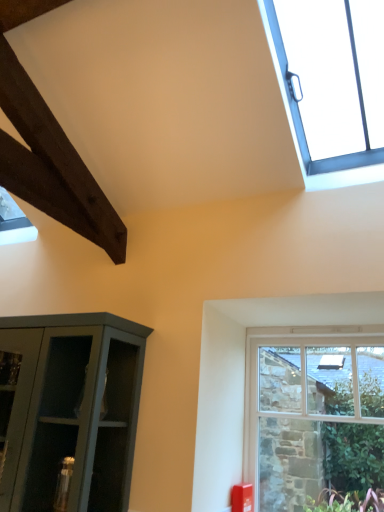
Image resolution: width=384 pixels, height=512 pixels. What do you see at coordinates (332, 78) in the screenshot?
I see `clear glass window at upper right, which is the second window from bottom to top` at bounding box center [332, 78].

The width and height of the screenshot is (384, 512). In order to click on clear glass window at upper right, marked as the 1th window in a top-to-bottom arrangement in this screenshot , I will do `click(332, 78)`.

Identify the location of clear glass window at lower right, the second window from the top. Image resolution: width=384 pixels, height=512 pixels. (244, 375).

What do you see at coordinates (244, 375) in the screenshot? Image resolution: width=384 pixels, height=512 pixels. I see `clear glass window at lower right, the second window from the top` at bounding box center [244, 375].

Locate an element on the screen. This screenshot has width=384, height=512. clear glass window at upper right, marked as the 1th window in a top-to-bottom arrangement is located at coordinates (332, 78).

Can you confirm if clear glass window at lower right, placed as the first window when sorted from bottom to top, is positioned to the left of clear glass window at upper right, marked as the 1th window in a top-to-bottom arrangement?

No, clear glass window at lower right, placed as the first window when sorted from bottom to top, is not to the left of clear glass window at upper right, marked as the 1th window in a top-to-bottom arrangement.

Considering the positions of objects clear glass window at lower right, placed as the first window when sorted from bottom to top, and clear glass window at upper right, which is the second window from bottom to top, in the image provided, who is behind, clear glass window at lower right, placed as the first window when sorted from bottom to top, or clear glass window at upper right, which is the second window from bottom to top,?

clear glass window at lower right, placed as the first window when sorted from bottom to top, is behind.

Considering the positions of point (226, 336) and point (350, 12), is point (226, 336) closer or farther from the camera than point (350, 12)?

Point (226, 336) is closer to the camera than point (350, 12).

From the image's perspective, is clear glass window at lower right, the second window from the top, beneath clear glass window at upper right, marked as the 1th window in a top-to-bottom arrangement?

Yes, from the image's perspective, clear glass window at lower right, the second window from the top, is beneath clear glass window at upper right, marked as the 1th window in a top-to-bottom arrangement.

From a real-world perspective, which object stands above the other?

From a 3D spatial view, clear glass window at upper right, marked as the 1th window in a top-to-bottom arrangement, is above.

Which of these two, clear glass window at lower right, the second window from the top, or clear glass window at upper right, marked as the 1th window in a top-to-bottom arrangement, is thinner?

clear glass window at lower right, the second window from the top.

Considering the relative sizes of clear glass window at lower right, the second window from the top, and clear glass window at upper right, which is the second window from bottom to top, in the image provided, is clear glass window at lower right, the second window from the top, taller than clear glass window at upper right, which is the second window from bottom to top,?

Indeed, clear glass window at lower right, the second window from the top, has a greater height compared to clear glass window at upper right, which is the second window from bottom to top.

Looking at this image, who is smaller, clear glass window at lower right, placed as the first window when sorted from bottom to top, or clear glass window at upper right, marked as the 1th window in a top-to-bottom arrangement?

clear glass window at lower right, placed as the first window when sorted from bottom to top.

Is clear glass window at upper right, which is the second window from bottom to top, surrounded by clear glass window at lower right, placed as the first window when sorted from bottom to top?

Actually, clear glass window at upper right, which is the second window from bottom to top, is outside clear glass window at lower right, placed as the first window when sorted from bottom to top.

Is clear glass window at lower right, placed as the first window when sorted from bottom to top, far away from clear glass window at upper right, which is the second window from bottom to top?

Yes, clear glass window at lower right, placed as the first window when sorted from bottom to top, and clear glass window at upper right, which is the second window from bottom to top, are located far from each other.

Is clear glass window at lower right, placed as the first window when sorted from bottom to top, aimed at clear glass window at upper right, which is the second window from bottom to top?

No, clear glass window at lower right, placed as the first window when sorted from bottom to top, is not turned towards clear glass window at upper right, which is the second window from bottom to top.

How distant is clear glass window at lower right, the second window from the top, from clear glass window at upper right, which is the second window from bottom to top?

A distance of 5.89 feet exists between clear glass window at lower right, the second window from the top, and clear glass window at upper right, which is the second window from bottom to top.

The width and height of the screenshot is (384, 512). I want to click on window below the clear glass window at upper right, marked as the 1th window in a top-to-bottom arrangement (from a real-world perspective), so click(x=244, y=375).

Which is more to the right, clear glass window at upper right, marked as the 1th window in a top-to-bottom arrangement, or clear glass window at lower right, placed as the first window when sorted from bottom to top?

From the viewer's perspective, clear glass window at lower right, placed as the first window when sorted from bottom to top, appears more on the right side.

Which is in front, clear glass window at upper right, which is the second window from bottom to top, or clear glass window at lower right, the second window from the top?

clear glass window at upper right, which is the second window from bottom to top, is closer to the camera.

Is point (302, 40) positioned in front of point (268, 317)?

No, (302, 40) is behind (268, 317).

From the image's perspective, is clear glass window at upper right, marked as the 1th window in a top-to-bottom arrangement, positioned above or below clear glass window at lower right, placed as the first window when sorted from bottom to top?

clear glass window at upper right, marked as the 1th window in a top-to-bottom arrangement, is situated higher than clear glass window at lower right, placed as the first window when sorted from bottom to top, in the image.

From a real-world perspective, between clear glass window at upper right, which is the second window from bottom to top, and clear glass window at lower right, placed as the first window when sorted from bottom to top, who is vertically lower?

In real-world perspective, clear glass window at lower right, placed as the first window when sorted from bottom to top, is lower.

Between clear glass window at upper right, marked as the 1th window in a top-to-bottom arrangement, and clear glass window at lower right, placed as the first window when sorted from bottom to top, which one has smaller width?

clear glass window at lower right, placed as the first window when sorted from bottom to top, is thinner.

From their relative heights in the image, would you say clear glass window at upper right, which is the second window from bottom to top, is taller or shorter than clear glass window at lower right, the second window from the top?

clear glass window at upper right, which is the second window from bottom to top, is shorter than clear glass window at lower right, the second window from the top.

In terms of size, does clear glass window at upper right, marked as the 1th window in a top-to-bottom arrangement, appear bigger or smaller than clear glass window at lower right, the second window from the top?

clear glass window at upper right, marked as the 1th window in a top-to-bottom arrangement, is bigger than clear glass window at lower right, the second window from the top.

Do you think clear glass window at upper right, marked as the 1th window in a top-to-bottom arrangement, is within clear glass window at lower right, the second window from the top, or outside of it?

clear glass window at upper right, marked as the 1th window in a top-to-bottom arrangement, is spatially situated outside clear glass window at lower right, the second window from the top.

Would you consider clear glass window at upper right, which is the second window from bottom to top, to be distant from clear glass window at lower right, placed as the first window when sorted from bottom to top?

Yes, clear glass window at upper right, which is the second window from bottom to top, and clear glass window at lower right, placed as the first window when sorted from bottom to top, are quite far apart.

Is clear glass window at lower right, placed as the first window when sorted from bottom to top, at the back of clear glass window at upper right, marked as the 1th window in a top-to-bottom arrangement?

No, clear glass window at upper right, marked as the 1th window in a top-to-bottom arrangement,'s orientation is not away from clear glass window at lower right, placed as the first window when sorted from bottom to top.

How different are the orientations of clear glass window at upper right, marked as the 1th window in a top-to-bottom arrangement, and clear glass window at lower right, placed as the first window when sorted from bottom to top, in degrees?

There is a 0.852-degree angle between the facing directions of clear glass window at upper right, marked as the 1th window in a top-to-bottom arrangement, and clear glass window at lower right, placed as the first window when sorted from bottom to top.

How distant is clear glass window at upper right, marked as the 1th window in a top-to-bottom arrangement, from clear glass window at lower right, placed as the first window when sorted from bottom to top?

A distance of 1.79 meters exists between clear glass window at upper right, marked as the 1th window in a top-to-bottom arrangement, and clear glass window at lower right, placed as the first window when sorted from bottom to top.

This screenshot has height=512, width=384. Find the location of `window that appears on the right of clear glass window at upper right, marked as the 1th window in a top-to-bottom arrangement`. window that appears on the right of clear glass window at upper right, marked as the 1th window in a top-to-bottom arrangement is located at coordinates (244, 375).

Find the location of a particular element. The width and height of the screenshot is (384, 512). window below the clear glass window at upper right, marked as the 1th window in a top-to-bottom arrangement (from a real-world perspective) is located at coordinates (x=244, y=375).

In order to click on window above the clear glass window at lower right, the second window from the top (from the image's perspective) in this screenshot , I will do `click(332, 78)`.